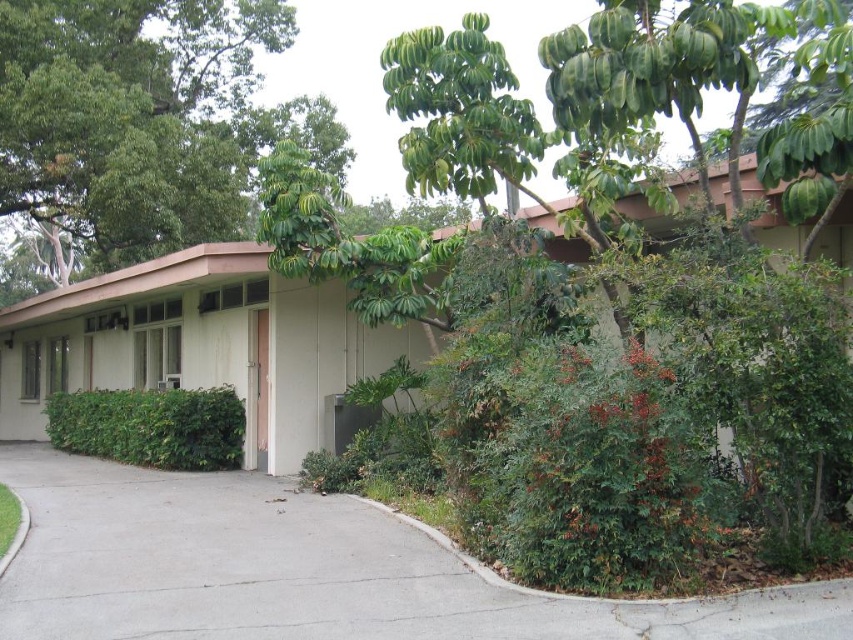
You are standing at the entrance of the house and looking towards the driveway. Which of the two plants, the green leafy tree at upper left or the green leafy bush at lower left, is closer to your left side?

The green leafy tree at upper left is positioned on the left side of the green leafy bush at lower left, so the green leafy tree at upper left is closer to your left side.